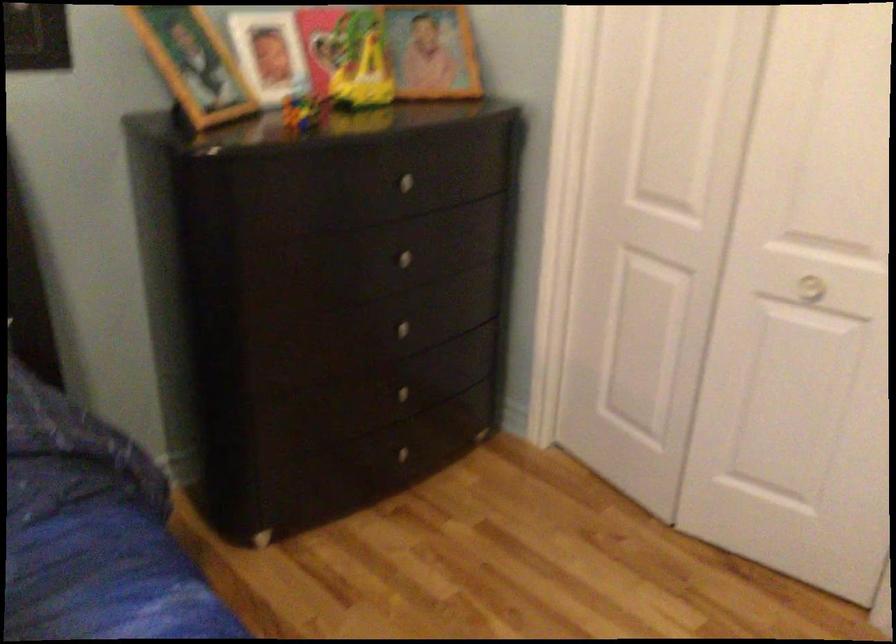
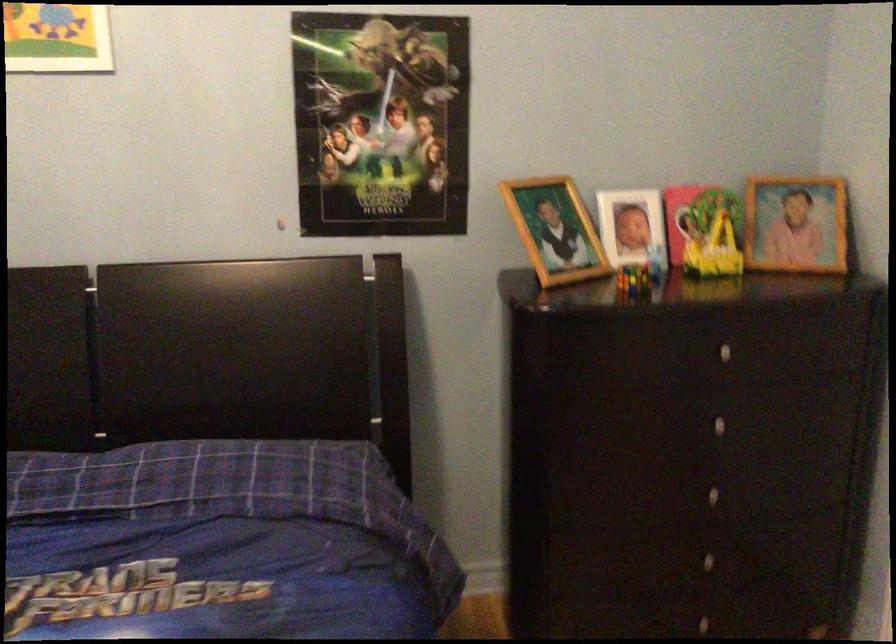
Where in the second image is the point corresponding to the point at 366,71 from the first image?

(719, 240)